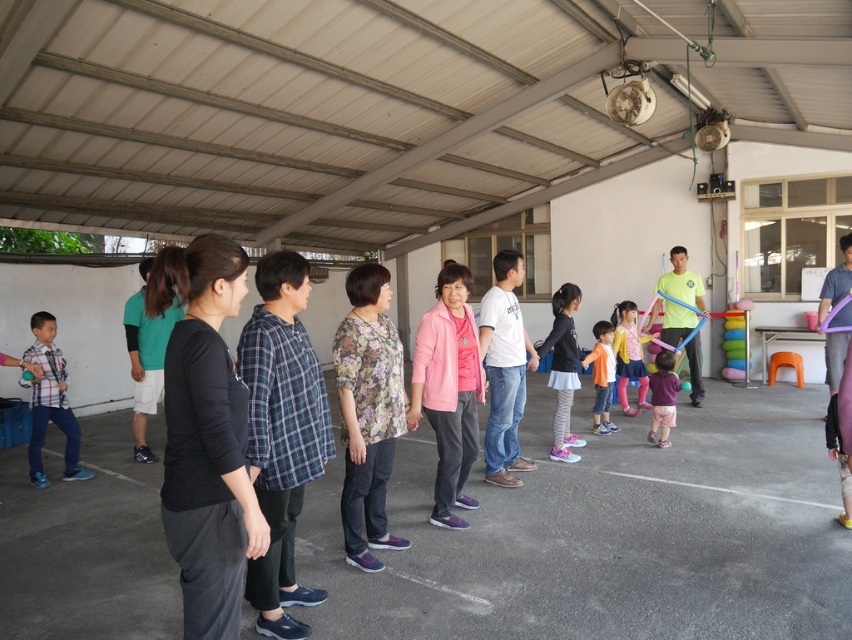
You are standing at the entrance of the room and see the light pink fabric skirt at center and the white asphalt line at lower center. Which object is closer to the entrance?

The light pink fabric skirt at center is closer to the entrance because it is to the left of the white asphalt line at lower center, which is further away from the entrance.

You are a photographer trying to capture the light pink fabric skirt at center and the white asphalt line at lower center in the same frame. Based on their positions, which object should you focus on first to ensure both are in focus?

The light pink fabric skirt at center is above the white asphalt line at lower center, so focusing on the skirt first will ensure both are in focus since it is closer to the camera.

You are a photographer trying to capture a group photo of the plaid fabric shirt at left and the orange fabric dress at center. Which clothing item should you focus on first if you want to ensure both are in frame and properly sized?

The plaid fabric shirt at left is larger in size than the orange fabric dress at center, so you should focus on the plaid fabric shirt at left first to ensure proper sizing for both.